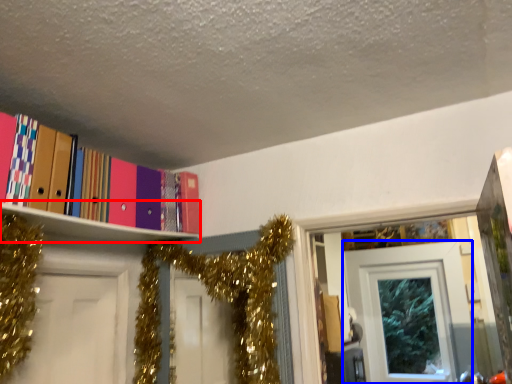
Question: Which point is further to the camera, shelf (highlighted by a red box) or door (highlighted by a blue box)?

Choices:
 (A) shelf
 (B) door

Answer: (B)